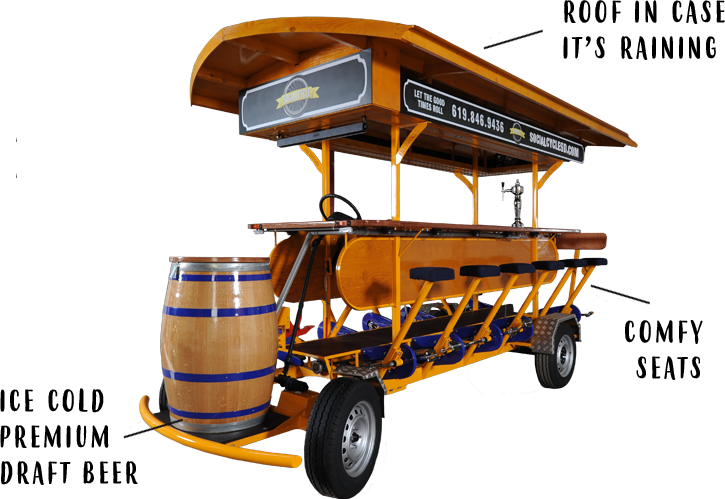
The height and width of the screenshot is (499, 725). In order to click on bar tabletop in this screenshot , I will do `click(365, 222)`, `click(478, 226)`, `click(536, 229)`.